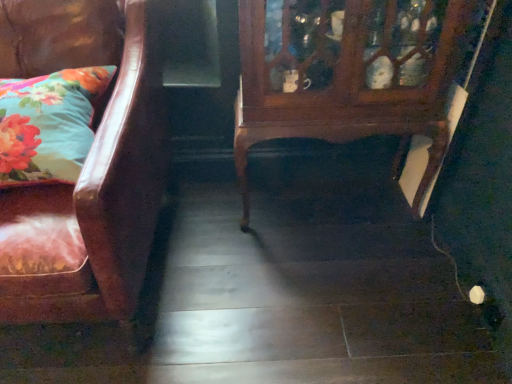
Question: Does leather couch at left have a greater width compared to wooden cabinet at center?

Choices:
 (A) yes
 (B) no

Answer: (A)

Question: Is leather couch at left not near wooden cabinet at center?

Choices:
 (A) yes
 (B) no

Answer: (B)

Question: Considering the relative sizes of leather couch at left and wooden cabinet at center in the image provided, is leather couch at left taller than wooden cabinet at center?

Choices:
 (A) yes
 (B) no

Answer: (A)

Question: Is leather couch at left thinner than wooden cabinet at center?

Choices:
 (A) no
 (B) yes

Answer: (A)

Question: From a real-world perspective, is leather couch at left positioned over wooden cabinet at center based on gravity?

Choices:
 (A) no
 (B) yes

Answer: (B)

Question: Is floral fabric pillow at left taller or shorter than wooden cabinet at center?

Choices:
 (A) tall
 (B) short

Answer: (B)

Question: From a real-world perspective, is floral fabric pillow at left physically located above or below wooden cabinet at center?

Choices:
 (A) above
 (B) below

Answer: (A)

Question: Considering the positions of point (61, 167) and point (265, 87), is point (61, 167) closer or farther from the camera than point (265, 87)?

Choices:
 (A) farther
 (B) closer

Answer: (B)

Question: Do you think floral fabric pillow at left is within wooden cabinet at center, or outside of it?

Choices:
 (A) inside
 (B) outside

Answer: (B)

Question: Which is correct: wooden cabinet at center is inside leather couch at left, or outside of it?

Choices:
 (A) outside
 (B) inside

Answer: (A)

Question: In terms of width, does wooden cabinet at center look wider or thinner when compared to leather couch at left?

Choices:
 (A) thin
 (B) wide

Answer: (A)

Question: Is wooden cabinet at center in front of or behind leather couch at left in the image?

Choices:
 (A) front
 (B) behind

Answer: (B)

Question: Considering the positions of point (431, 41) and point (137, 77), is point (431, 41) closer or farther from the camera than point (137, 77)?

Choices:
 (A) closer
 (B) farther

Answer: (B)

Question: Relative to floral fabric pillow at left, is leather couch at left in front or behind?

Choices:
 (A) behind
 (B) front

Answer: (B)

Question: From a real-world perspective, is leather couch at left physically located above or below floral fabric pillow at left?

Choices:
 (A) above
 (B) below

Answer: (B)